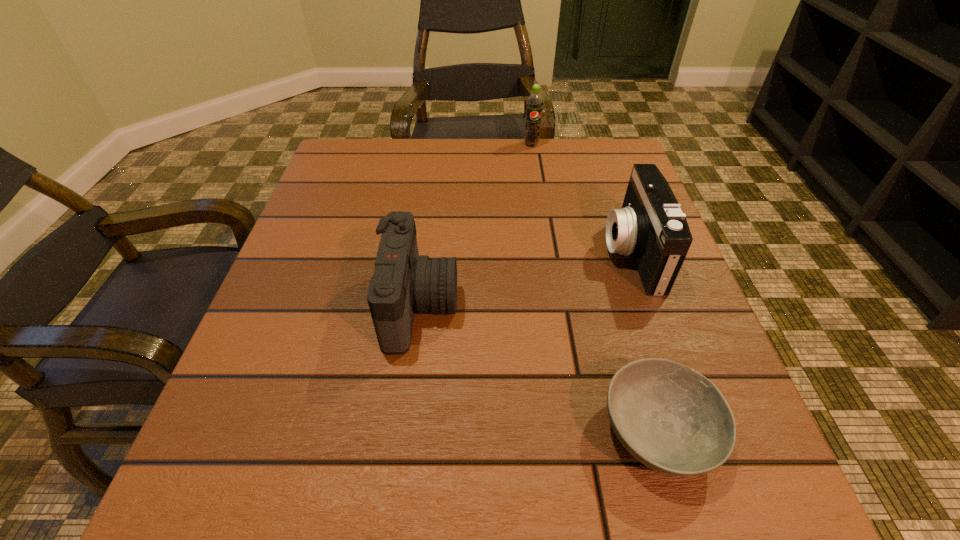
Locate an element on the screen. This screenshot has height=540, width=960. vacant space situated 0.130m at the lens of the leftmost object is located at coordinates (531, 306).

You are a GUI agent. You are given a task and a screenshot of the screen. Output one action in this format:
    pyautogui.click(x=<x>, y=<y>)
    Task: Click on the free space located on the back of the bowl
    
    Given the screenshot: What is the action you would take?
    pyautogui.click(x=608, y=261)

At what (x,y) coordinates should I click in order to perform the action: click on object that is at the far edge. Please return your answer as a coordinate pair (x, y). This screenshot has height=540, width=960. Looking at the image, I should click on (534, 103).

At what (x,y) coordinates should I click in order to perform the action: click on object that is at the near edge. Please return your answer as a coordinate pair (x, y). Looking at the image, I should click on (672, 419).

Where is `camcorder at the right edge`? The height and width of the screenshot is (540, 960). camcorder at the right edge is located at coordinates (x=650, y=226).

The width and height of the screenshot is (960, 540). I want to click on bowl situated at the right edge, so click(x=672, y=419).

At what (x,y) coordinates should I click in order to perform the action: click on object that is positioned at the near right corner. Please return your answer as a coordinate pair (x, y). The image size is (960, 540). Looking at the image, I should click on (672, 419).

Identify the location of vacant region at the far edge of the desktop. The height and width of the screenshot is (540, 960). (459, 173).

Image resolution: width=960 pixels, height=540 pixels. Find the location of `vacant region at the near edge`. vacant region at the near edge is located at coordinates (588, 466).

Locate an element on the screen. vacant space at the left edge of the desktop is located at coordinates (323, 209).